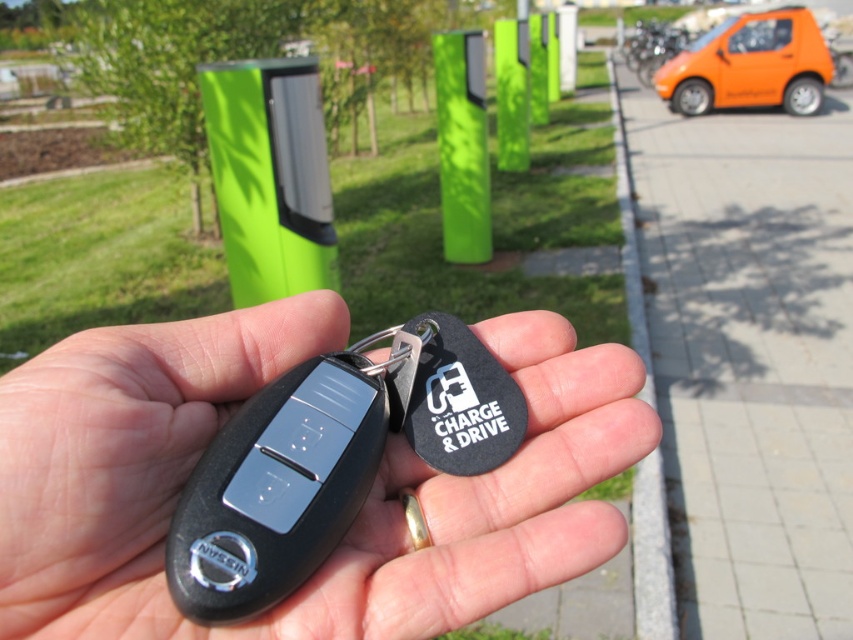
Question: Can you confirm if black matte key fob at center is positioned to the left of orange matte car at right?

Choices:
 (A) no
 (B) yes

Answer: (B)

Question: Is black matte key fob at center to the right of orange matte car at right from the viewer's perspective?

Choices:
 (A) no
 (B) yes

Answer: (A)

Question: Which point is farther to the camera?

Choices:
 (A) (265, 339)
 (B) (714, 51)

Answer: (B)

Question: Does black matte key fob at center lie in front of green matte pole at center?

Choices:
 (A) yes
 (B) no

Answer: (A)

Question: Which object is farther from the camera taking this photo?

Choices:
 (A) orange matte car at right
 (B) green matte pole at center
 (C) black matte key fob at center

Answer: (A)

Question: Which of the following is the closest to the observer?

Choices:
 (A) (799, 33)
 (B) (451, 156)

Answer: (B)